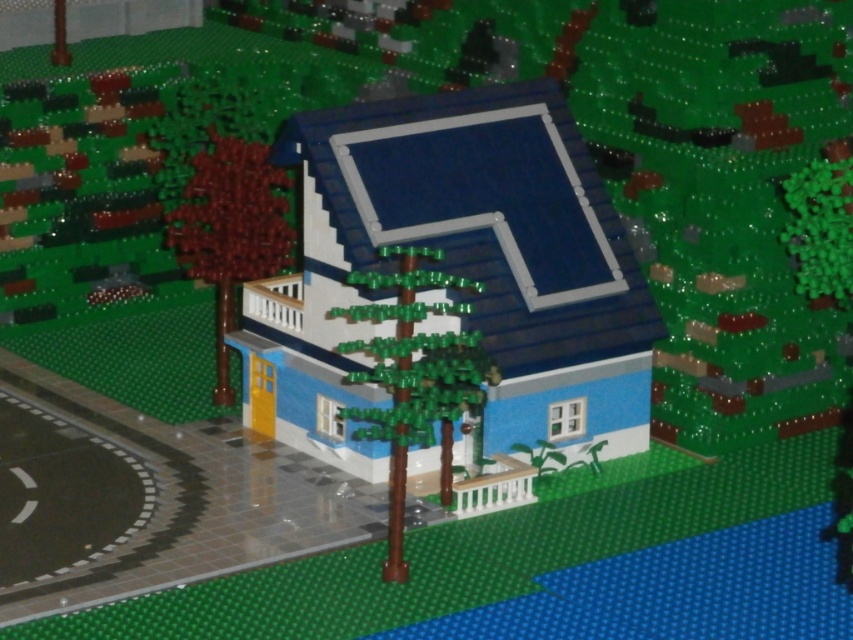
You are standing at the origin point of the coordinate system in the LEGO house scene. You want to place a new red LEGO flower exactly 0.1 units to the right of the green matte tree at center. What are the coordinates where you should place the flower?

The green matte tree at center is located at point (415, 376). To place the red LEGO flower 0.1 units to the right, add 0.1 to the x coordinate. The new coordinates would be (415, 440).

You are standing in the LEGO model scene and want to place a LEGO boat that is 2 meters long on the blue bricks. Is there enough space between you and the brown matte tree at left to maneuver the boat?

The distance between you and the brown matte tree at left is 3.32 meters. Since the boat is 2 meters long, there is sufficient space to maneuver the boat between you and the tree.

You are standing in front of the LEGO house and see two points marked on the image. The first point is at coordinate point (x=415, y=269) and the second is at point (x=810, y=276). Which point is closer to you?

Point (x=415, y=269) is in front of point (x=810, y=276), so it is closer to you.